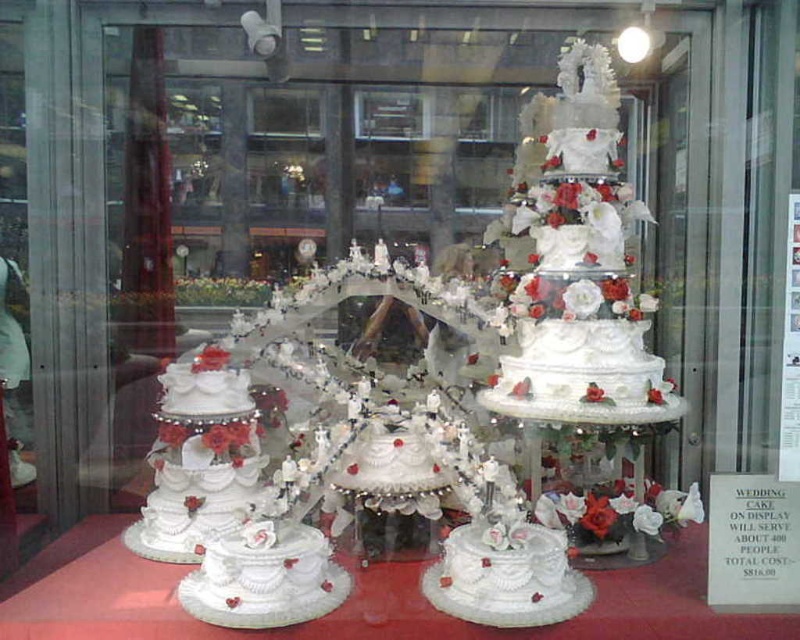
Question: Among these objects, which one is nearest to the camera?

Choices:
 (A) white glossy cake at center
 (B) white textured cake at center

Answer: (A)

Question: Is white textured cake at center positioned in front of white glossy cake at center?

Choices:
 (A) yes
 (B) no

Answer: (B)

Question: Can you confirm if white textured cake at center is thinner than white glossy cake at center?

Choices:
 (A) no
 (B) yes

Answer: (A)

Question: Can you confirm if white textured cake at center is bigger than white glossy cake at center?

Choices:
 (A) yes
 (B) no

Answer: (A)

Question: Which object appears closest to the camera in this image?

Choices:
 (A) white textured cake at center
 (B) white glossy cake at center

Answer: (B)